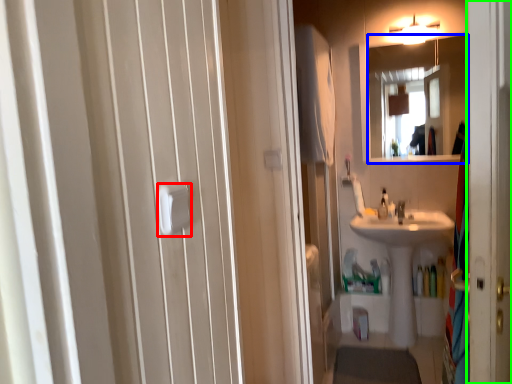
Question: Which object is positioned farthest from towel bar (highlighted by a red box)? Select from mirror (highlighted by a blue box) and screen door (highlighted by a green box).

Choices:
 (A) mirror
 (B) screen door

Answer: (A)